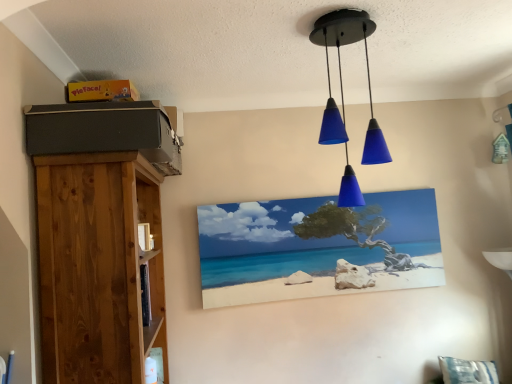
Question: Is blue glass pendant lights at upper center at the back of matte canvas painting at center?

Choices:
 (A) no
 (B) yes

Answer: (A)

Question: Considering the relative sizes of matte canvas painting at center and blue glass pendant lights at upper center in the image provided, is matte canvas painting at center shorter than blue glass pendant lights at upper center?

Choices:
 (A) yes
 (B) no

Answer: (A)

Question: Considering the relative sizes of matte canvas painting at center and blue glass pendant lights at upper center in the image provided, is matte canvas painting at center smaller than blue glass pendant lights at upper center?

Choices:
 (A) no
 (B) yes

Answer: (B)

Question: Is matte canvas painting at center located outside blue glass pendant lights at upper center?

Choices:
 (A) no
 (B) yes

Answer: (B)

Question: Can you confirm if matte canvas painting at center is thinner than blue glass pendant lights at upper center?

Choices:
 (A) no
 (B) yes

Answer: (B)

Question: Is matte canvas painting at center next to blue glass pendant lights at upper center and touching it?

Choices:
 (A) yes
 (B) no

Answer: (B)

Question: Is matte canvas painting at center wider than natural wood bookshelf at left?

Choices:
 (A) yes
 (B) no

Answer: (B)

Question: Is matte canvas painting at center shorter than natural wood bookshelf at left?

Choices:
 (A) no
 (B) yes

Answer: (B)

Question: Considering the relative positions of matte canvas painting at center and natural wood bookshelf at left in the image provided, is matte canvas painting at center in front of natural wood bookshelf at left?

Choices:
 (A) yes
 (B) no

Answer: (B)

Question: Is matte canvas painting at center to the right of natural wood bookshelf at left from the viewer's perspective?

Choices:
 (A) no
 (B) yes

Answer: (B)

Question: From a real-world perspective, is matte canvas painting at center over natural wood bookshelf at left?

Choices:
 (A) yes
 (B) no

Answer: (A)

Question: From a real-world perspective, is matte canvas painting at center beneath natural wood bookshelf at left?

Choices:
 (A) no
 (B) yes

Answer: (A)

Question: From the image's perspective, is blue glass pendant lights at upper center located beneath natural wood bookshelf at left?

Choices:
 (A) no
 (B) yes

Answer: (A)